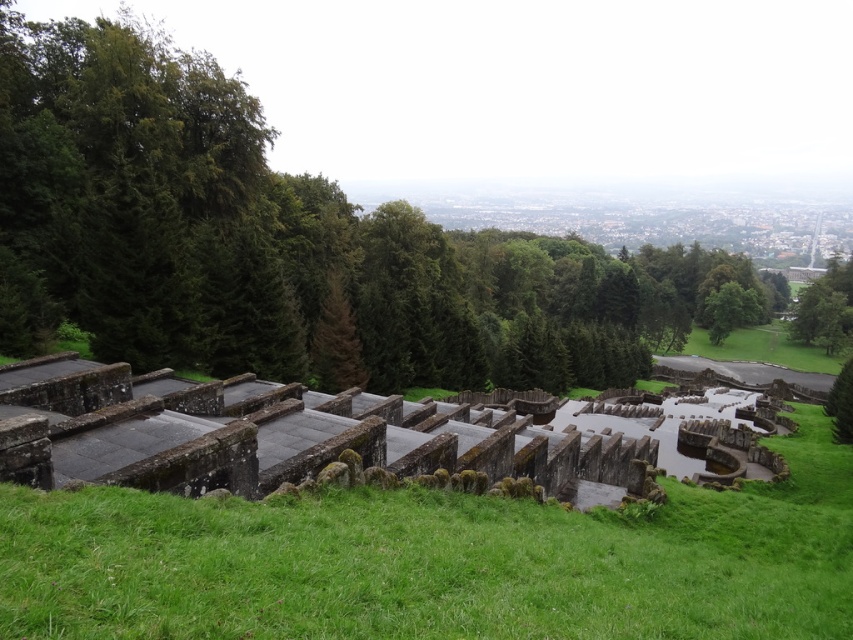
Does green leafy tree at upper center have a lesser width compared to green leafy tree at lower right?

Incorrect, green leafy tree at upper center's width is not less than green leafy tree at lower right's.

Describe the element at coordinates (730, 308) in the screenshot. The image size is (853, 640). I see `green leafy tree at upper center` at that location.

This screenshot has height=640, width=853. Describe the element at coordinates (730, 308) in the screenshot. I see `green leafy tree at upper center` at that location.

Identify the location of green leafy tree at upper center. (730, 308).